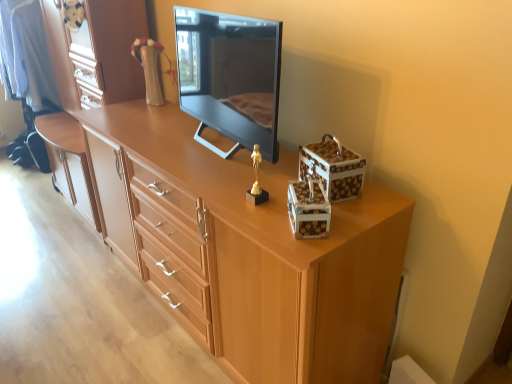
Where is `vacant space situated on the left part of gold metallic statue at center`? The height and width of the screenshot is (384, 512). vacant space situated on the left part of gold metallic statue at center is located at coordinates (221, 193).